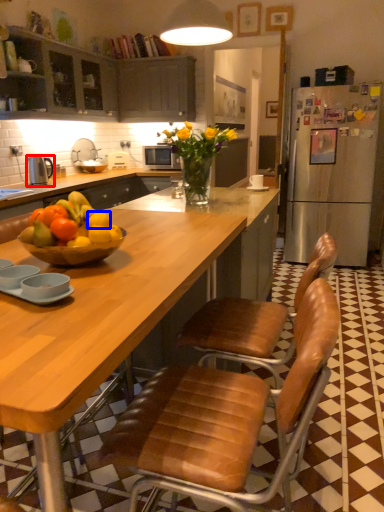
Question: Which object is further to the camera taking this photo, kitchen appliance (highlighted by a red box) or orange (highlighted by a blue box)?

Choices:
 (A) kitchen appliance
 (B) orange

Answer: (A)